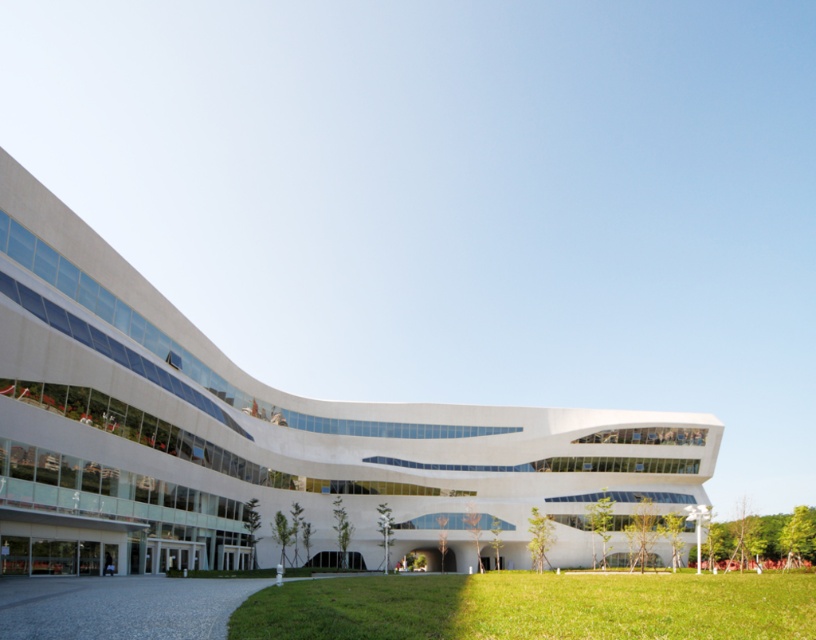
Who is more distant from viewer, (469, 465) or (574, 588)?

The point (469, 465) is more distant.

Where is `white smooth building at center`? The image size is (816, 640). white smooth building at center is located at coordinates pyautogui.click(x=269, y=440).